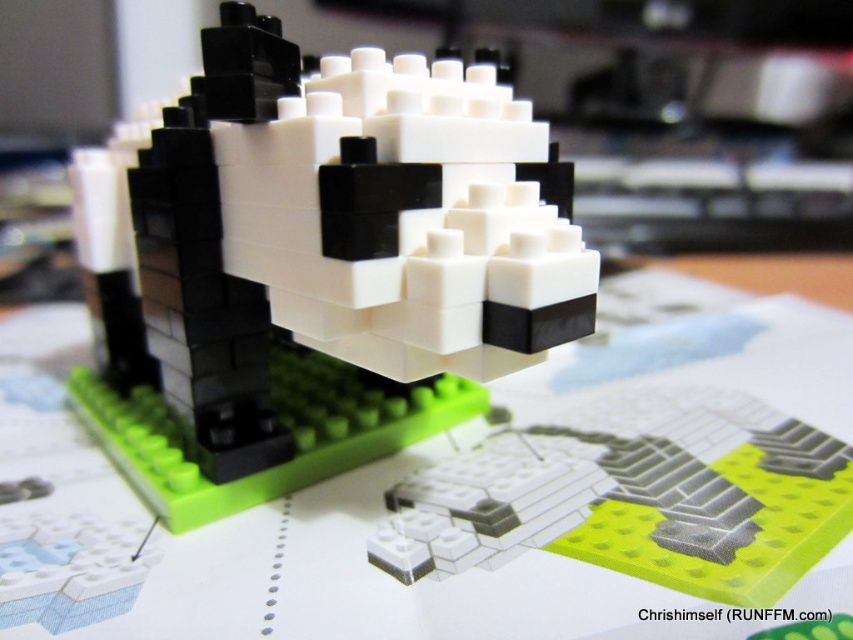
You are trying to place a new LEGO set on the table. The set requires a surface area of 30x30 cm. Given the green plastic table at center and the black matte lego dog at center, can the table accommodate the LEGO set?

The green plastic table at center is larger in size compared to the black matte lego dog at center, so it can accommodate the LEGO set requiring a 30x30 cm surface area.

You are organizing a display for a LEGO exhibition and need to place the green plastic table at center and the black matte lego dog at center. According to the scene, which object is located to the right of the other?

The green plastic table at center is positioned on the right side of black matte lego dog at center, so the green plastic table at center is to the right of the black matte lego dog at center.